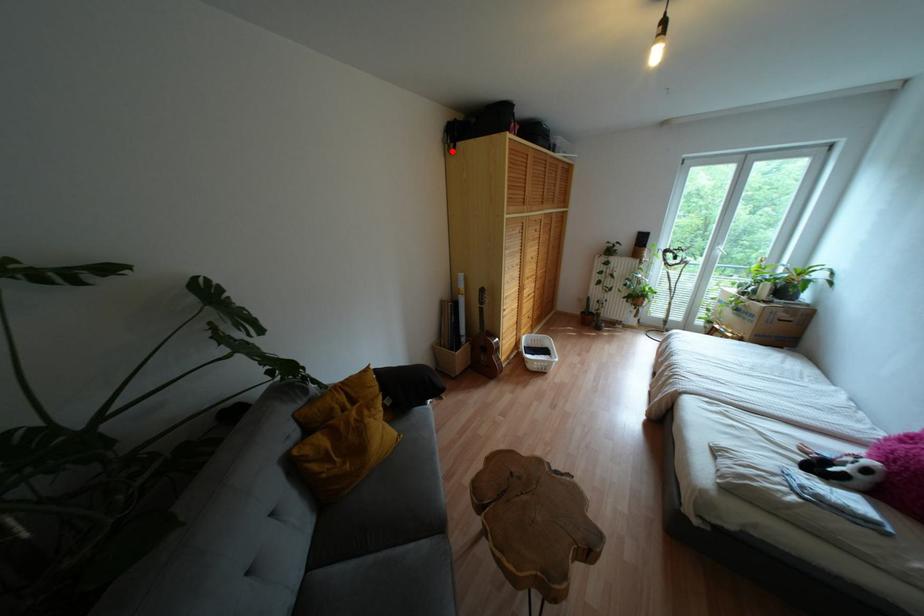
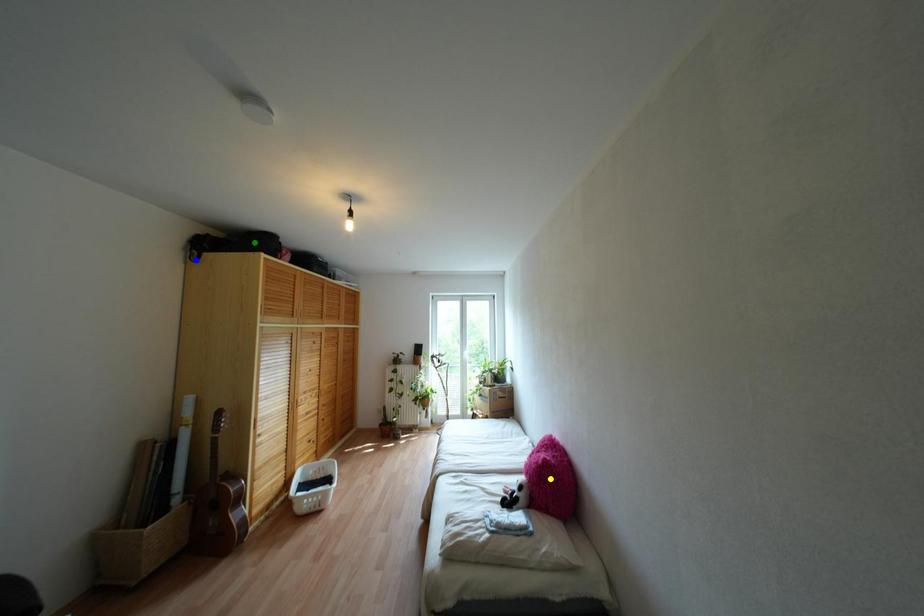
Question: I am providing you with two images of the same scene from different viewpoints. A red point is marked on the first image. You are given multiple points on the second image. Which mark in image 2 goes with the point in image 1?

Choices:
 (A) blue point
 (B) green point
 (C) yellow point

Answer: (A)